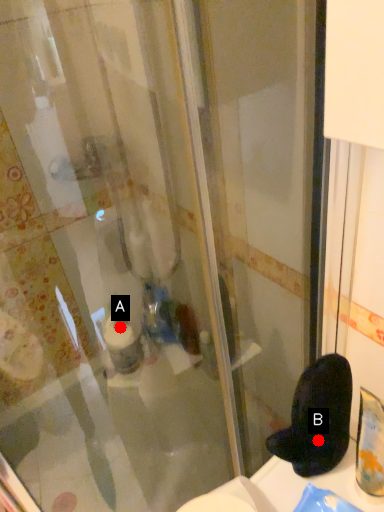
Question: Two points are circled on the image, labeled by A and B beside each circle. Which point appears closest to the camera in this image?

Choices:
 (A) A is closer
 (B) B is closer

Answer: (B)